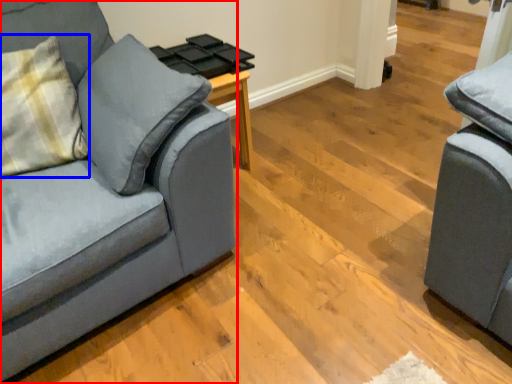
Question: Which point is closer to the camera, studio couch (highlighted by a red box) or throw pillow (highlighted by a blue box)?

Choices:
 (A) studio couch
 (B) throw pillow

Answer: (A)